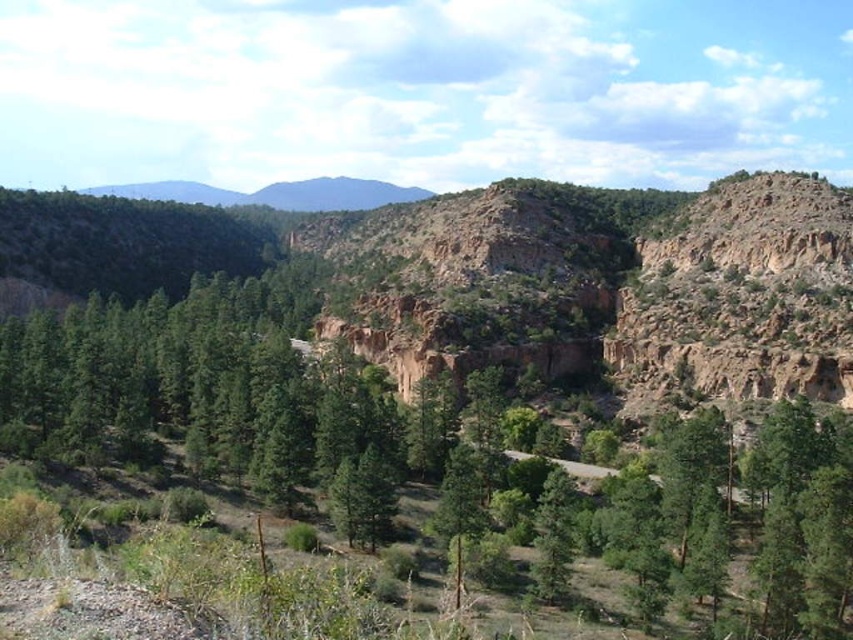
You are a hiker standing at the edge of the winding road in the middle ground of the mountainous terrain. You notice two trees at the center of the scene. Which tree is taller between the green matte tree at center and the green rough bark tree at center?

The green matte tree at center is much taller than the green rough bark tree at center according to the description.

You are a hiker standing at the edge of the winding road in the middle ground. You see the green matte tree at center and the green rough bark tree at center. Which tree is closer to you?

The green matte tree at center is closer to you because the green rough bark tree at center is positioned behind it.

You are a hiker planning to cross the winding road in the middle of the mountainous terrain. You notice two trees at the center of the scene, the green matte tree at center and the green rough bark tree at center. Which tree has a wider trunk? Please choose between the two.

The green matte tree at center has a wider trunk than the green rough bark tree at center.